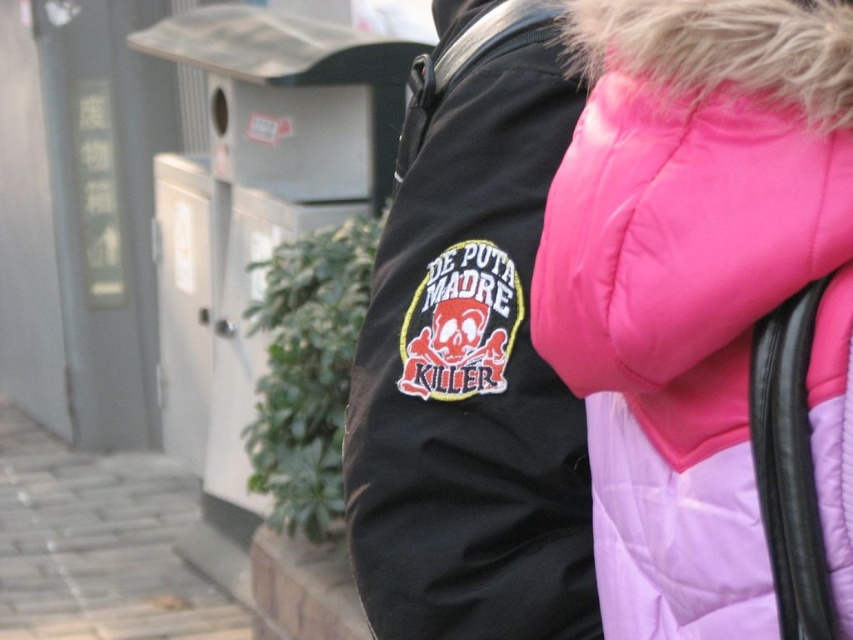
Measure the distance from black matte jacket at center to gray brick pavement at lower left.

A distance of 3.94 meters exists between black matte jacket at center and gray brick pavement at lower left.

How distant is black matte jacket at center from gray brick pavement at lower left?

black matte jacket at center is 12.93 feet from gray brick pavement at lower left.

The height and width of the screenshot is (640, 853). Identify the location of black matte jacket at center. (469, 355).

Locate an element on the screen. The image size is (853, 640). black matte jacket at center is located at coordinates (469, 355).

Does pink quilted jacket at upper right come in front of gray brick pavement at lower left?

That is True.

Between point (773, 364) and point (82, 625), which one is positioned in front?

Point (773, 364)

Where is `pink quilted jacket at upper right`? The image size is (853, 640). pink quilted jacket at upper right is located at coordinates (708, 310).

Can you confirm if pink quilted jacket at upper right is taller than black matte jacket at center?

Incorrect, pink quilted jacket at upper right's height is not larger of black matte jacket at center's.

What do you see at coordinates (708, 310) in the screenshot? Image resolution: width=853 pixels, height=640 pixels. I see `pink quilted jacket at upper right` at bounding box center [708, 310].

Who is more distant from viewer, (700, 356) or (572, 124)?

Point (572, 124)

The image size is (853, 640). I want to click on pink quilted jacket at upper right, so [x=708, y=310].